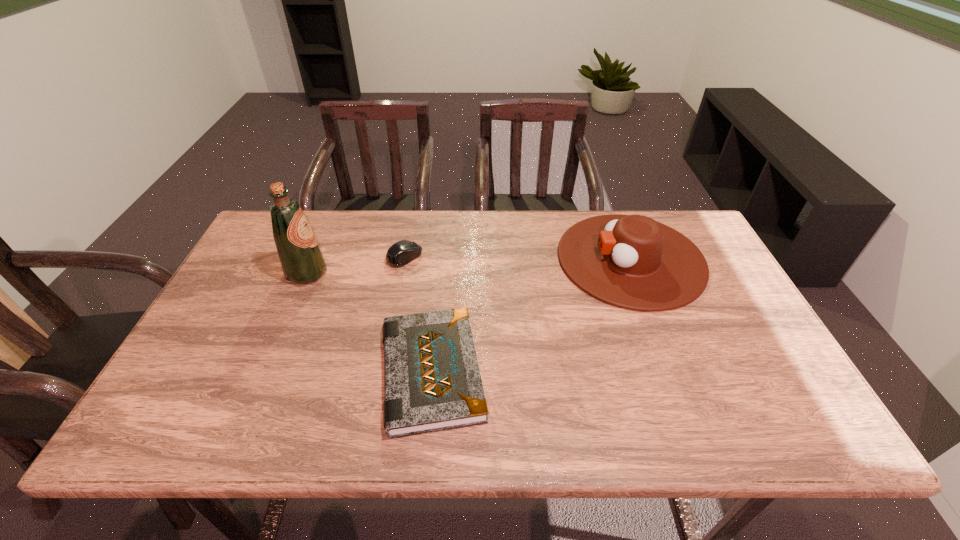
Locate an element on the screen. The image size is (960, 540). vacant space located 0.320m on the right of the mouse is located at coordinates (528, 257).

The height and width of the screenshot is (540, 960). What are the coordinates of `vacant space located on the back of the nearest object` in the screenshot? It's located at (443, 263).

I want to click on cowboy hat that is at the far edge, so click(630, 261).

This screenshot has height=540, width=960. Find the location of `mouse present at the far edge`. mouse present at the far edge is located at coordinates (401, 253).

Locate an element on the screen. The width and height of the screenshot is (960, 540). object located at the near edge is located at coordinates (432, 382).

Find the location of a particular element. The width and height of the screenshot is (960, 540). object located at the left edge is located at coordinates (302, 261).

At what (x,y) coordinates should I click in order to perform the action: click on object located in the right edge section of the desktop. Please return your answer as a coordinate pair (x, y). The height and width of the screenshot is (540, 960). Looking at the image, I should click on (630, 261).

The width and height of the screenshot is (960, 540). What are the coordinates of `object situated at the far right corner` in the screenshot? It's located at (630, 261).

I want to click on free region at the far edge of the desktop, so click(x=409, y=213).

You are a GUI agent. You are given a task and a screenshot of the screen. Output one action in this format:
    pyautogui.click(x=<x>, y=<y>)
    Task: Click on the blank space at the near edge of the desktop
    
    Given the screenshot: What is the action you would take?
    pyautogui.click(x=262, y=417)